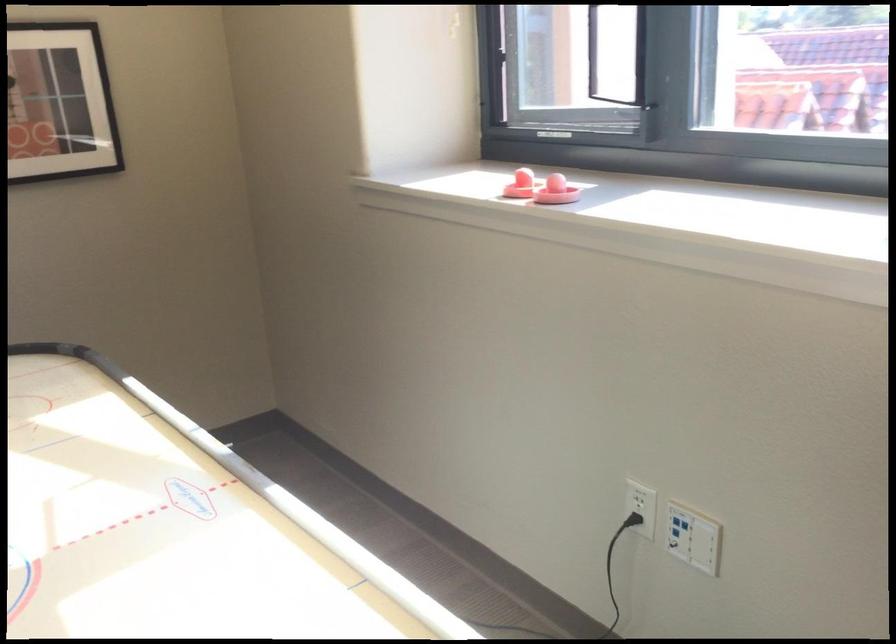
You are a GUI agent. You are given a task and a screenshot of the screen. Output one action in this format:
    pyautogui.click(x=<x>, y=<y>)
    Task: Click on the black window latch
    This screenshot has height=644, width=896.
    Given the screenshot: What is the action you would take?
    pyautogui.click(x=638, y=102)